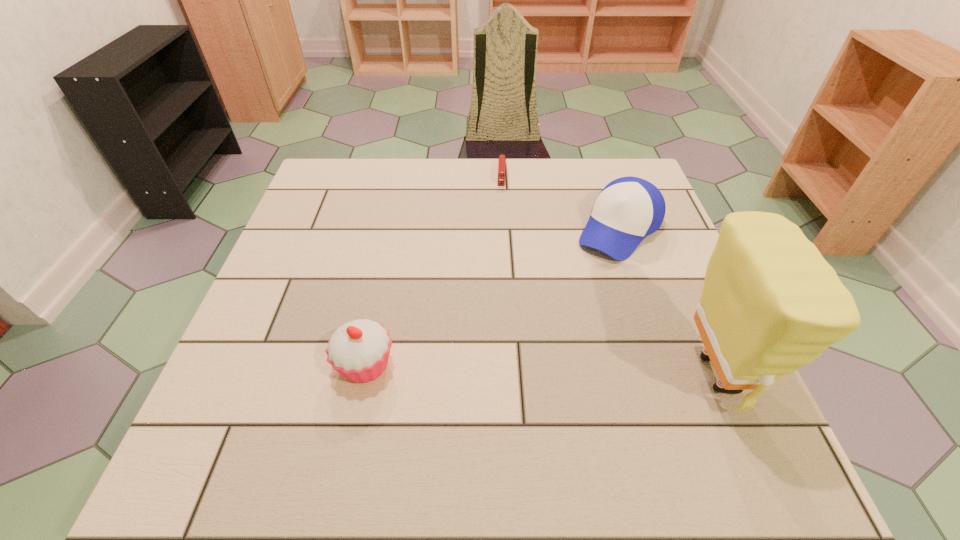
The width and height of the screenshot is (960, 540). In order to click on free space on the desktop that is between the leftmost object and the sponge and is positioned on the front-facing side of the baseball cap in this screenshot , I will do `click(496, 369)`.

Find the location of `free space on the desktop that is between the leftmost object and the tallest object and is positioned on the front-facing side of the shortest object`. free space on the desktop that is between the leftmost object and the tallest object and is positioned on the front-facing side of the shortest object is located at coordinates (493, 369).